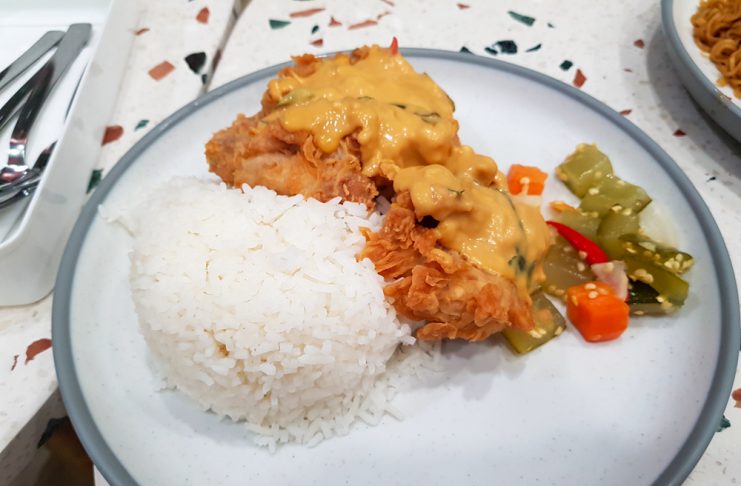
This screenshot has width=741, height=486. Find the location of `silverware`. silverware is located at coordinates (52, 73), (21, 101), (19, 72).